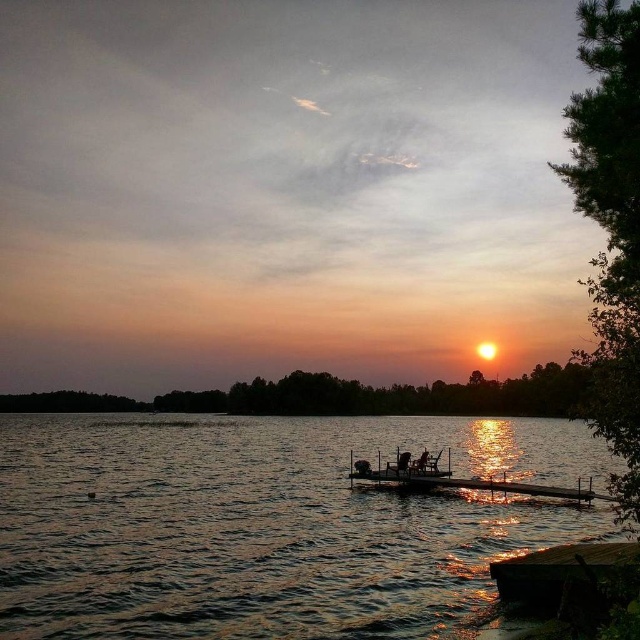
You are standing on the wooden dock facing the sunset. You see two points marked in the scene. Which point is closer to you, point [145,483] or point [531,592]?

Point [145,483] is further to the camera than point [531,592]. Wait, the question asks which is closer to you. Since point [145,483] is further away from the camera, that means it is farther from the observer. Therefore, the closer point would be point [531,592].